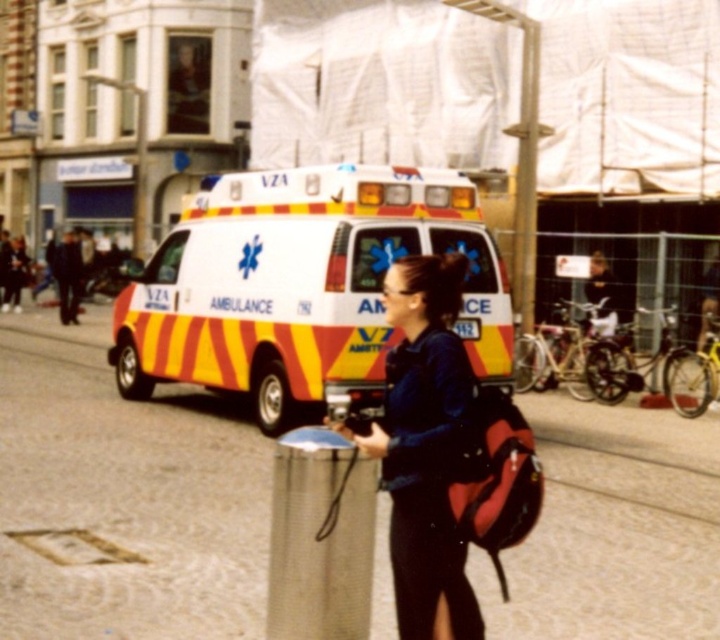
Question: Which object is the closest to the concrete pavement at center?

Choices:
 (A) matte blue shirt at center
 (B) yellow and white striped ambulance at center

Answer: (A)

Question: Which point appears closest to the camera in this image?

Choices:
 (A) 294,310
 (B) 423,284
 (C) 230,440

Answer: (B)

Question: Which of these objects is positioned closest to the yellow and white striped ambulance at center?

Choices:
 (A) matte blue shirt at center
 (B) concrete pavement at center

Answer: (B)

Question: Is yellow and white striped ambulance at center closer to camera compared to matte blue shirt at center?

Choices:
 (A) no
 (B) yes

Answer: (A)

Question: Does concrete pavement at center have a greater width compared to yellow and white striped ambulance at center?

Choices:
 (A) no
 (B) yes

Answer: (B)

Question: Does concrete pavement at center appear on the right side of yellow and white striped ambulance at center?

Choices:
 (A) yes
 (B) no

Answer: (B)